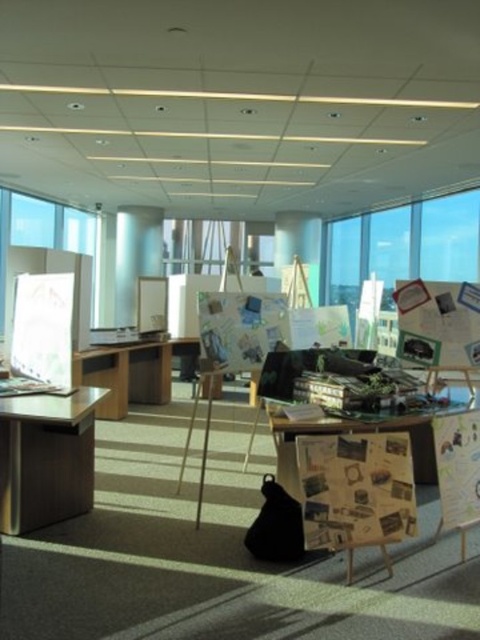
Who is higher up, wooden glass table at center or wooden bulletin board at center right?

Positioned higher is wooden glass table at center.

Is wooden glass table at center to the left of wooden bulletin board at center right from the viewer's perspective?

Correct, you'll find wooden glass table at center to the left of wooden bulletin board at center right.

Between point (319, 429) and point (465, 465), which one is positioned behind?

The point (465, 465) is behind.

The image size is (480, 640). I want to click on wooden glass table at center, so click(358, 432).

Is point (28, 506) closer to viewer compared to point (8, 248)?

Yes, it is in front of point (8, 248).

Which is behind, point (17, 445) or point (26, 221)?

The point (26, 221) is behind.

Identify the location of wooden table at left. The width and height of the screenshot is (480, 640). (47, 458).

Does wooden glass table at center appear under transparent glass window at upper left?

Indeed, wooden glass table at center is positioned under transparent glass window at upper left.

Is point (289, 476) positioned before point (14, 208)?

Yes, it is.

The image size is (480, 640). Identify the location of wooden glass table at center. [x=358, y=432].

Where is `wooden glass table at center`? The width and height of the screenshot is (480, 640). wooden glass table at center is located at coordinates (358, 432).